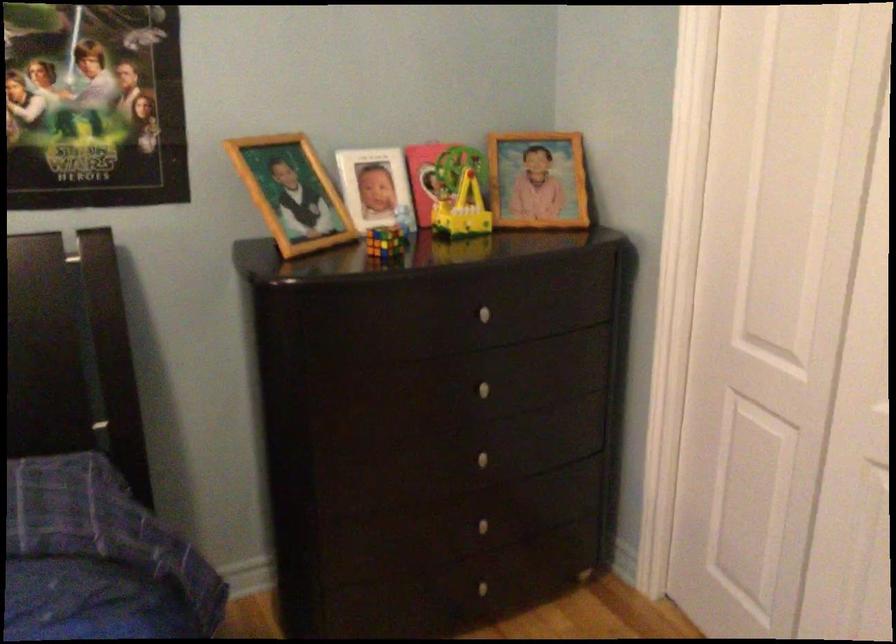
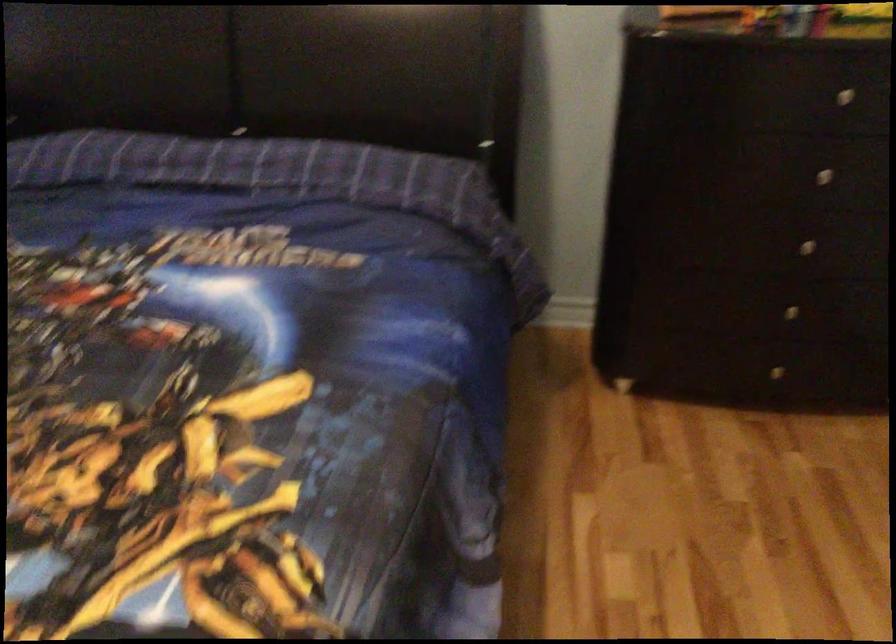
Find the pixel in the second image that matches (x=490, y=522) in the first image.

(790, 310)